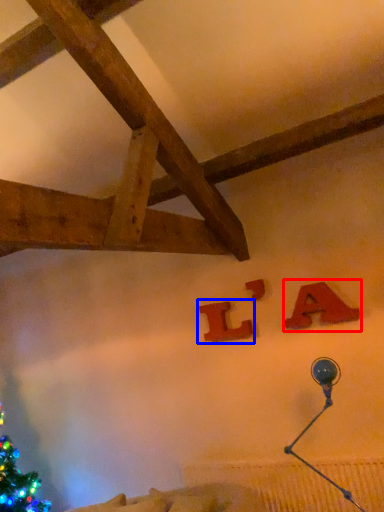
Question: Which object appears closest to the camera in this image, alphabet (highlighted by a red box) or alphabet (highlighted by a blue box)?

Choices:
 (A) alphabet
 (B) alphabet

Answer: (A)